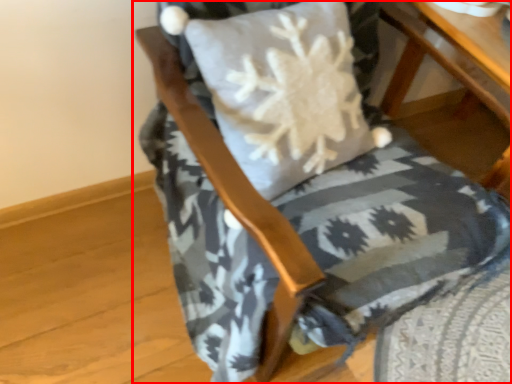
Question: Observing the image, what is the correct spatial positioning of chair (annotated by the red box) in reference to table?

Choices:
 (A) left
 (B) right

Answer: (A)